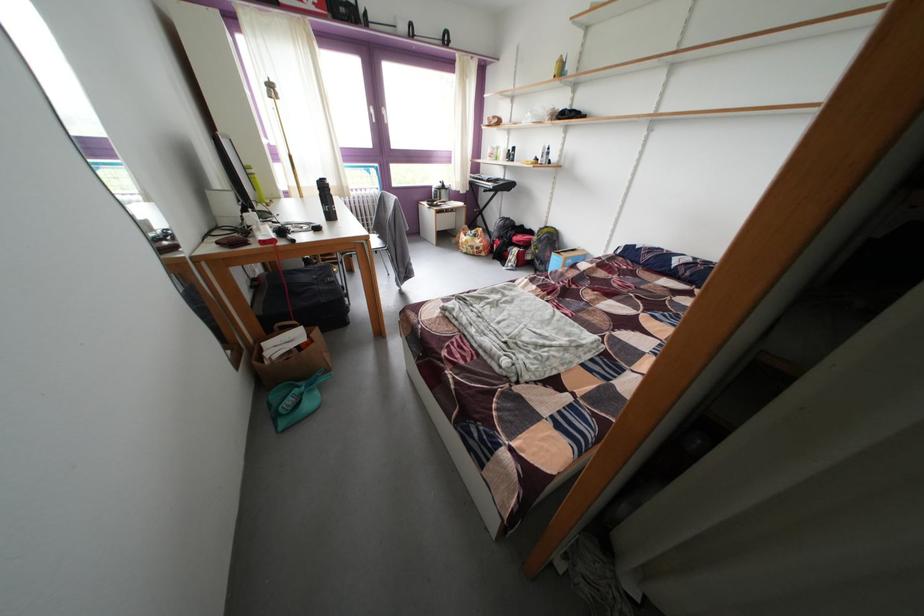
The height and width of the screenshot is (616, 924). Describe the element at coordinates (385, 254) in the screenshot. I see `a chair sitting surface` at that location.